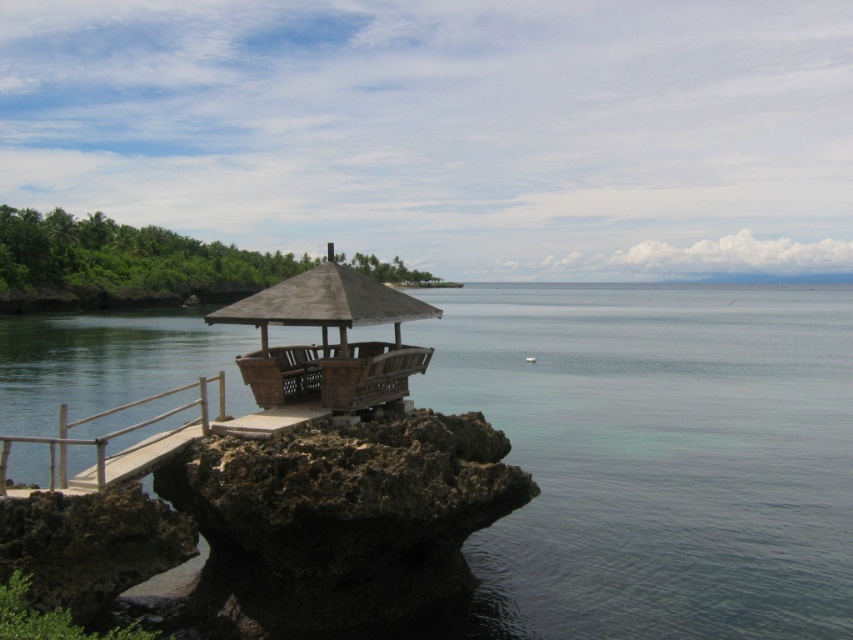
You are a visitor standing on the rocky shore looking towards the wooden pavilion. You see the clear blue water at center and the white wood rail at lower left. Which object is located to the right of the other?

The clear blue water at center is positioned on the right side of white wood rail at lower left.

You are a photographer planning to capture the clear blue water at center and the white wood rail at lower left in a single frame. Given that your camera has a limited field of view, which object should you prioritize framing first to ensure both are visible?

Since the clear blue water at center is bigger than the white wood rail at lower left, you should prioritize framing the larger clear blue water at center first to ensure both fit within the camera frame.

You are standing on the rocky shore and want to reach the wooden walkway leading to the pavilion. You notice the clear blue water at center and the white wood rail at lower left. Which object is located below the other?

The white wood rail at lower left is positioned below the clear blue water at center, as the clear blue water at center is over it.